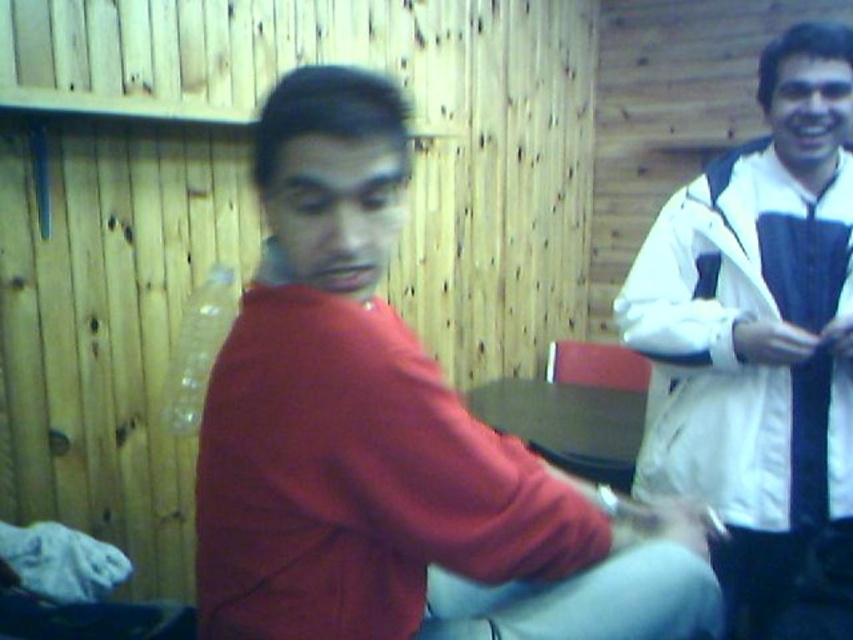
Can you confirm if matte red shirt at center is wider than black silk tie at right?

Yes, matte red shirt at center is wider than black silk tie at right.

Does matte red shirt at center lie behind black silk tie at right?

No, matte red shirt at center is closer to the viewer.

Who is more distant from viewer, (369, 163) or (810, 465)?

Point (810, 465)

The width and height of the screenshot is (853, 640). In order to click on matte red shirt at center in this screenshot , I will do `click(392, 438)`.

Between white matte jacket at upper right and black silk tie at right, which one appears on the right side from the viewer's perspective?

black silk tie at right is more to the right.

Is white matte jacket at upper right positioned before black silk tie at right?

Yes, white matte jacket at upper right is in front of black silk tie at right.

This screenshot has width=853, height=640. What are the coordinates of `white matte jacket at upper right` in the screenshot? It's located at (759, 344).

Does matte red shirt at center have a greater width compared to white matte jacket at upper right?

Yes, matte red shirt at center is wider than white matte jacket at upper right.

Who is shorter, matte red shirt at center or white matte jacket at upper right?

matte red shirt at center

Find the location of `matte red shirt at center`. matte red shirt at center is located at coordinates (392, 438).

Image resolution: width=853 pixels, height=640 pixels. I want to click on matte red shirt at center, so click(x=392, y=438).